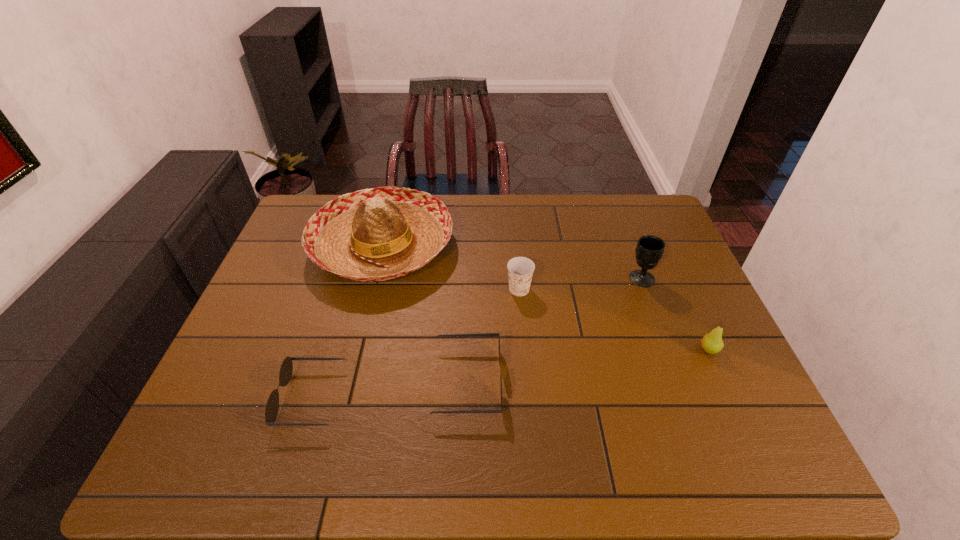
The width and height of the screenshot is (960, 540). What are the coordinates of `object that is the fourth closest to the tallest object` in the screenshot? It's located at click(x=649, y=250).